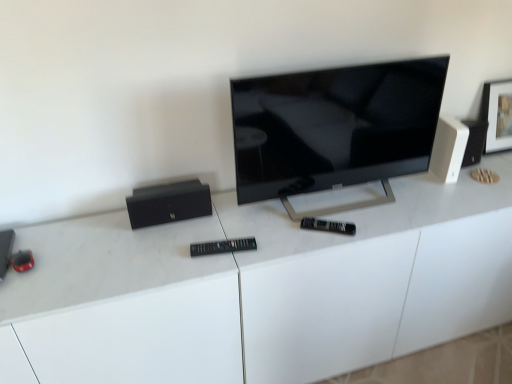
This screenshot has width=512, height=384. Find the location of `free space between black plastic remote at center and white plastic speaker at upper right, arranged as the 3th speaker when viewed from the left`. free space between black plastic remote at center and white plastic speaker at upper right, arranged as the 3th speaker when viewed from the left is located at coordinates (347, 212).